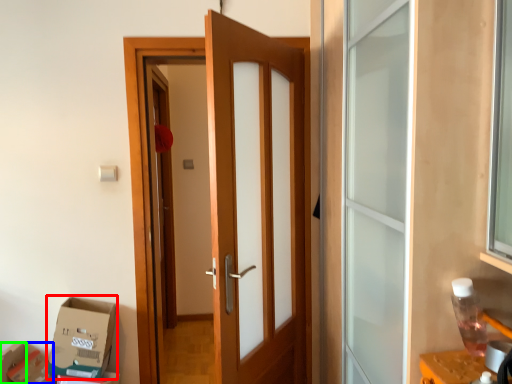
Question: Which is farther away from cardboard box (highlighted by a red box)? cardboard box (highlighted by a blue box) or box (highlighted by a green box)?

Choices:
 (A) cardboard box
 (B) box

Answer: (B)